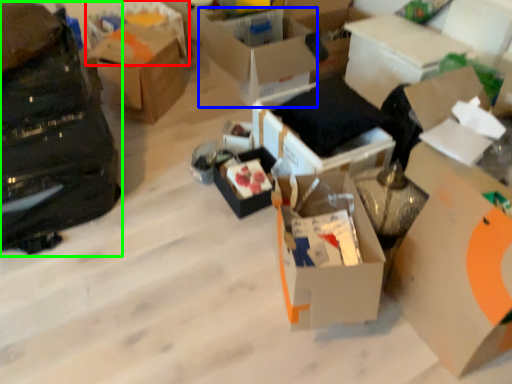
Question: Estimate the real-world distances between objects in this image. Which object is closer to storage box (highlighted by a red box), box (highlighted by a blue box) or bag (highlighted by a green box)?

Choices:
 (A) box
 (B) bag

Answer: (A)